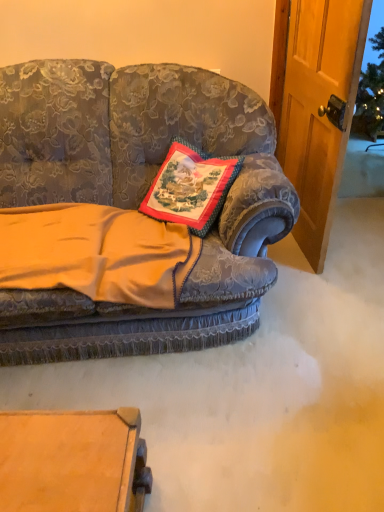
Question: Is velvet gold blanket at center surrounded by velvet floral couch at center?

Choices:
 (A) yes
 (B) no

Answer: (A)

Question: Would you say velvet floral couch at center is outside velvet gold blanket at center?

Choices:
 (A) no
 (B) yes

Answer: (B)

Question: Can you confirm if velvet floral couch at center is bigger than velvet gold blanket at center?

Choices:
 (A) yes
 (B) no

Answer: (A)

Question: Considering the relative sizes of velvet floral couch at center and velvet gold blanket at center in the image provided, is velvet floral couch at center taller than velvet gold blanket at center?

Choices:
 (A) no
 (B) yes

Answer: (B)

Question: Does velvet floral couch at center have a lesser height compared to velvet gold blanket at center?

Choices:
 (A) no
 (B) yes

Answer: (A)

Question: From the image's perspective, is velvet floral couch at center located above velvet gold blanket at center?

Choices:
 (A) yes
 (B) no

Answer: (A)

Question: Considering the relative sizes of velvet gold blanket at center and velvet floral couch at center in the image provided, is velvet gold blanket at center bigger than velvet floral couch at center?

Choices:
 (A) yes
 (B) no

Answer: (B)

Question: Is velvet gold blanket at center in front of velvet floral couch at center?

Choices:
 (A) no
 (B) yes

Answer: (A)

Question: Considering the relative positions of velvet gold blanket at center and velvet floral couch at center in the image provided, is velvet gold blanket at center to the right of velvet floral couch at center from the viewer's perspective?

Choices:
 (A) no
 (B) yes

Answer: (A)

Question: Is the depth of velvet gold blanket at center greater than that of velvet floral couch at center?

Choices:
 (A) no
 (B) yes

Answer: (B)

Question: From a real-world perspective, is velvet gold blanket at center located beneath velvet floral couch at center?

Choices:
 (A) yes
 (B) no

Answer: (A)

Question: Can you confirm if velvet gold blanket at center is smaller than velvet floral couch at center?

Choices:
 (A) yes
 (B) no

Answer: (A)

Question: From the image's perspective, is velvet gold blanket at center below embroidered fabric pillow at center?

Choices:
 (A) no
 (B) yes

Answer: (B)